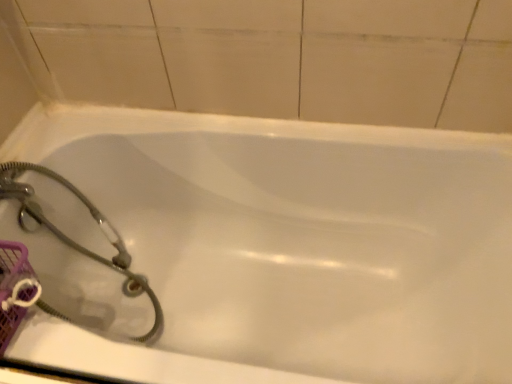
The image size is (512, 384). What do you see at coordinates (74, 241) in the screenshot?
I see `metallic gray hose at lower left` at bounding box center [74, 241].

This screenshot has height=384, width=512. Identify the location of metallic gray hose at lower left. (74, 241).

Find the location of `metallic gray hose at lower left`. metallic gray hose at lower left is located at coordinates (74, 241).